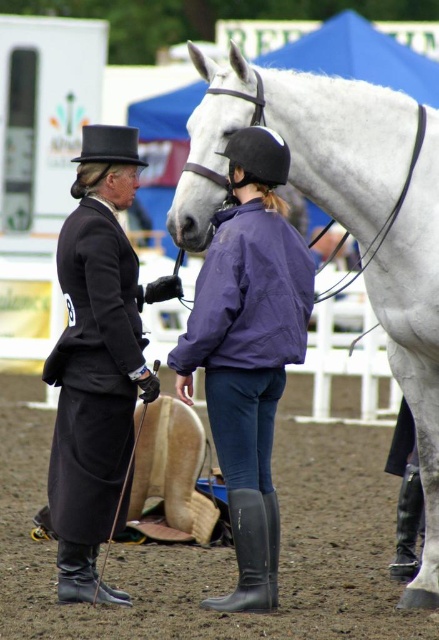
Question: From the image, what is the correct spatial relationship of white glossy horse at center in relation to black rubber boot at lower right?

Choices:
 (A) right
 (B) left

Answer: (B)

Question: Among these points, which one is farthest from the camera?

Choices:
 (A) (121, 134)
 (B) (87, 532)

Answer: (A)

Question: Can you confirm if white glossy horse at center is wider than black felt dress hat at upper left?

Choices:
 (A) yes
 (B) no

Answer: (A)

Question: Which point is closer to the camera?

Choices:
 (A) (150, 371)
 (B) (254, 97)
 (C) (405, 557)

Answer: (B)

Question: Based on their relative distances, which object is nearer to the rubber/matte boot at lower center?

Choices:
 (A) black rubber boot at lower right
 (B) black rubber boot at lower left
 (C) black felt dress hat at upper left
 (D) white glossy horse at center

Answer: (B)

Question: Can you confirm if black leather jacket at left is positioned to the right of black rubber boot at lower left?

Choices:
 (A) yes
 (B) no

Answer: (A)